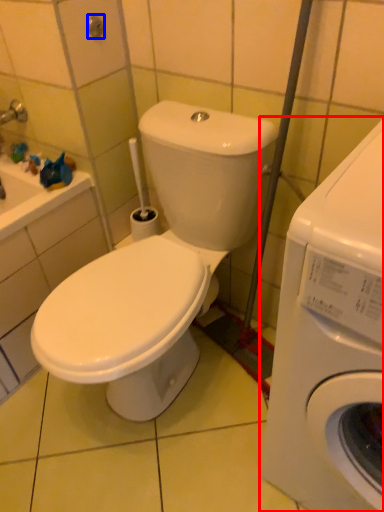
Question: Which object is closer to the camera taking this photo, washing machine (highlighted by a red box) or shower (highlighted by a blue box)?

Choices:
 (A) washing machine
 (B) shower

Answer: (A)